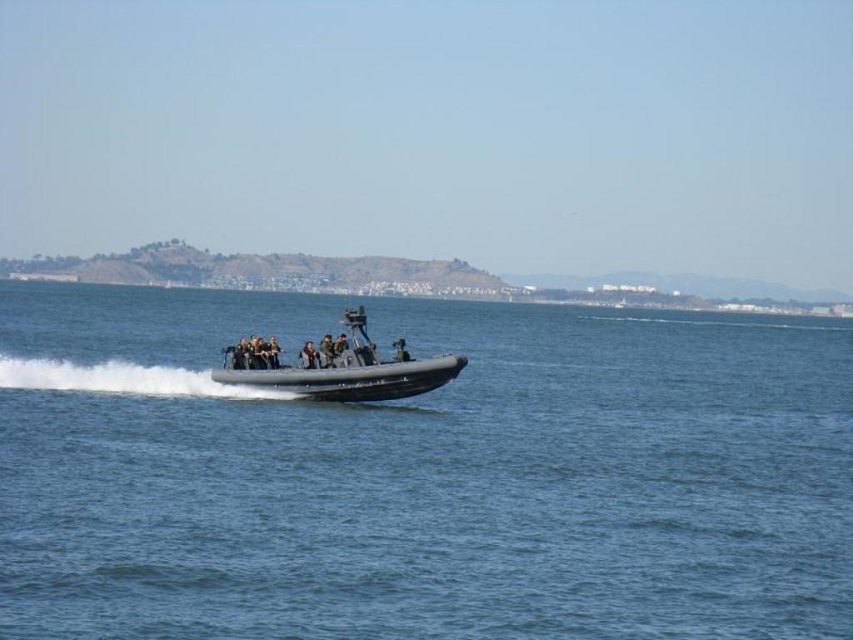
Question: Can you confirm if dark gray rubber boat at center is positioned above black matte uniform at center?

Choices:
 (A) yes
 (B) no

Answer: (A)

Question: Estimate the real-world distances between objects in this image. Which object is closer to the black matte uniform at center?

Choices:
 (A) dark gray rubber boat at center
 (B) clear blue water at center

Answer: (A)

Question: Which point is closer to the camera?

Choices:
 (A) black matte uniform at center
 (B) clear blue water at center

Answer: (B)

Question: Can you confirm if clear blue water at center is positioned to the left of black matte uniform at center?

Choices:
 (A) yes
 (B) no

Answer: (B)

Question: Which point is closer to the camera?

Choices:
 (A) clear blue water at center
 (B) black matte uniform at center
 (C) dark gray rubber boat at center

Answer: (A)

Question: Can you confirm if clear blue water at center is smaller than dark gray rubber boat at center?

Choices:
 (A) no
 (B) yes

Answer: (A)